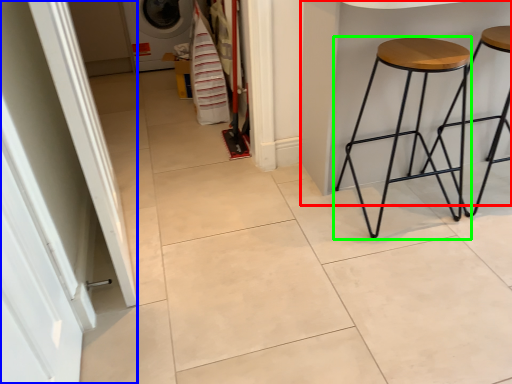
Question: Based on their relative distances, which object is nearer to table (highlighted by a red box)? Choose from screen door (highlighted by a blue box) and stool (highlighted by a green box).

Choices:
 (A) screen door
 (B) stool

Answer: (B)